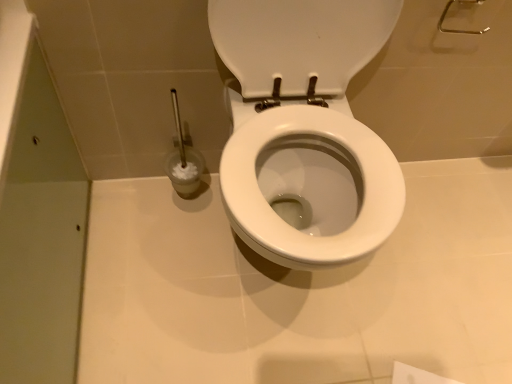
The image size is (512, 384). In order to click on vacant area that is in front of clear plastic brush at left in this screenshot , I will do `click(164, 238)`.